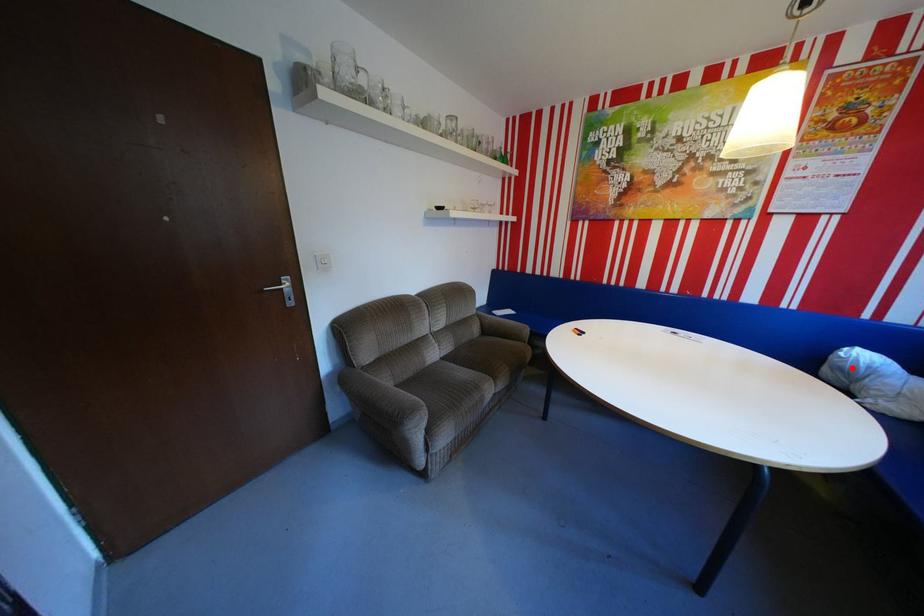
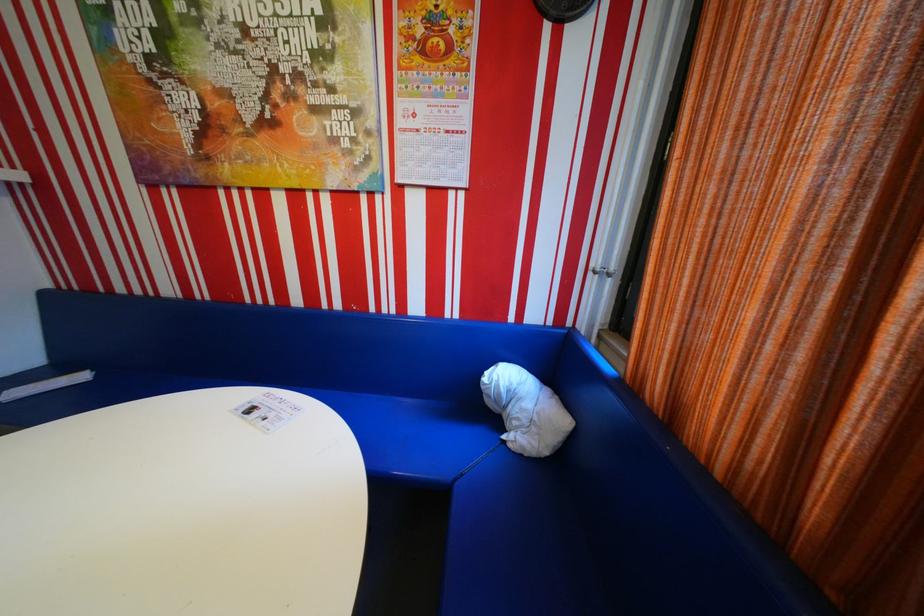
Question: I am providing you with two images of the same scene from different viewpoints. A red point is marked on the first image. Can you still see the location of the red point in image 2?

Choices:
 (A) Yes
 (B) No

Answer: (A)